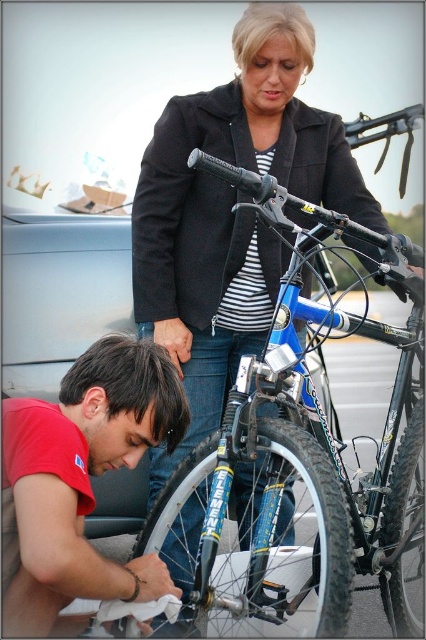
You are standing at the point with coordinates point (397, 522) and want to move to the point with coordinates point (293, 547). Is the path directly between these two points clear of any obstacles?

The point (293, 547) is behind point (397, 522), so the path between them is likely blocked by the person or bicycle in front of point (397, 522).

You are a delivery person who needs to load both the blue matte bicycle at center and the matte red shirt at lower left into a truck. The truck has a height restriction of 1.5 meters. Can both items fit vertically without exceeding the height limit?

The blue matte bicycle at center is taller than the matte red shirt at lower left. Since the truck has a height restriction of 1.5 meters, we need to know the exact height of the bicycle. However, the description only states the bicycle is taller than the shirt, but does not provide specific measurements. Without knowing the bicycle height, we cannot confirm if it fits within the 1.5 meter limit.

You are standing in the parking lot and see the matte red shirt at lower left and the black rubber tire at lower right. Which object is nearer to you?

The matte red shirt at lower left is closer to the viewer than the black rubber tire at lower right.